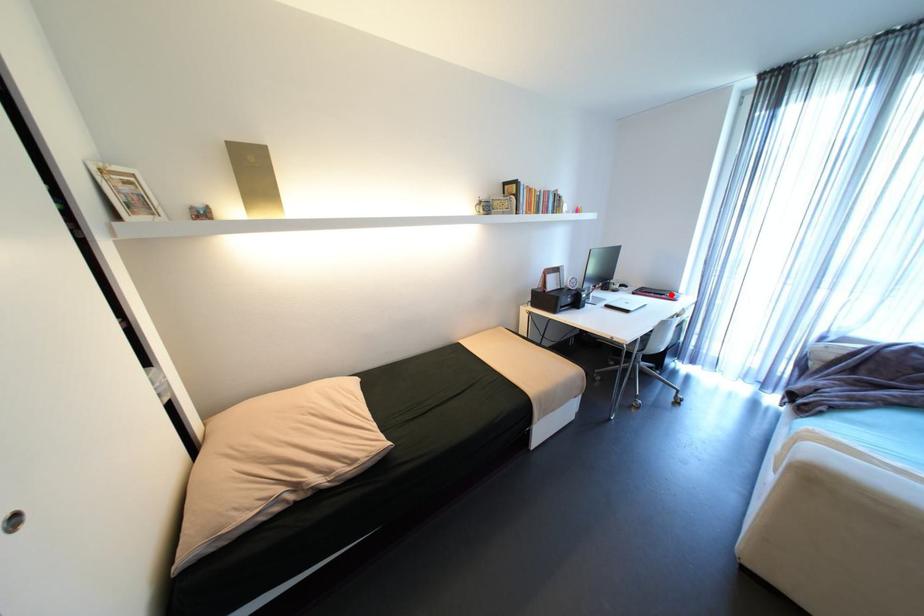
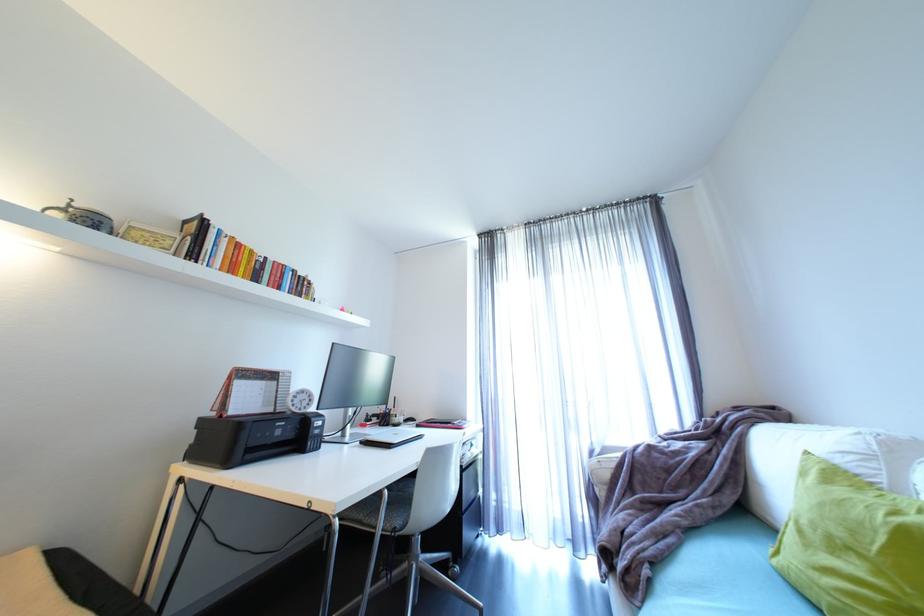
Question: I am providing you with two images of the same scene from different viewpoints. A red point is marked on the first image. Can you still see the location of the red point in image 2?

Choices:
 (A) Yes
 (B) No

Answer: (A)